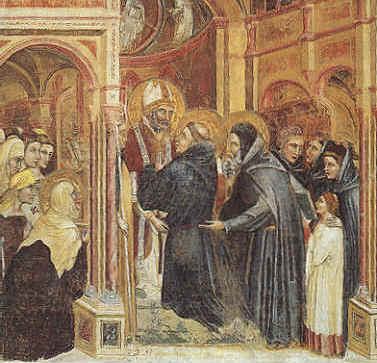
Where is `wall`? wall is located at coordinates (329, 35).